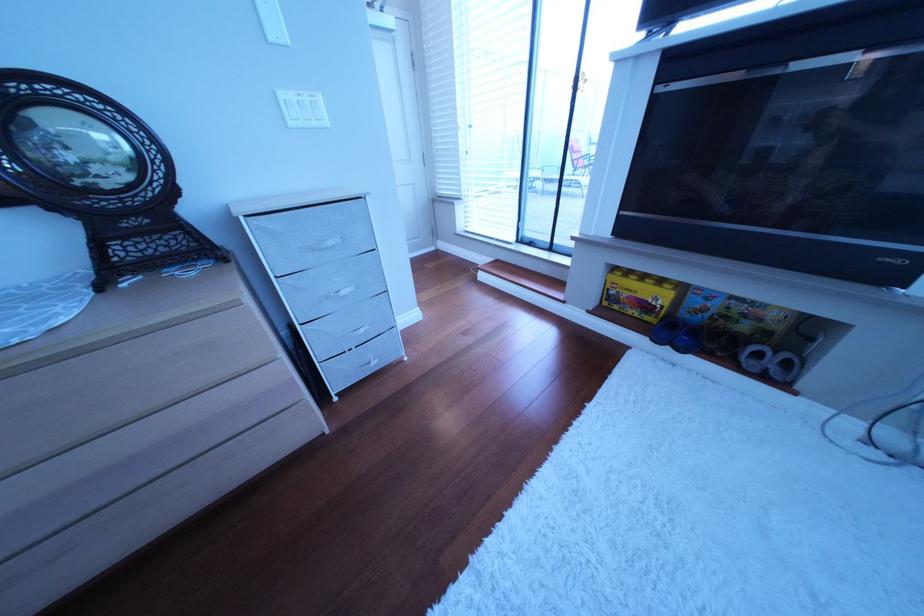
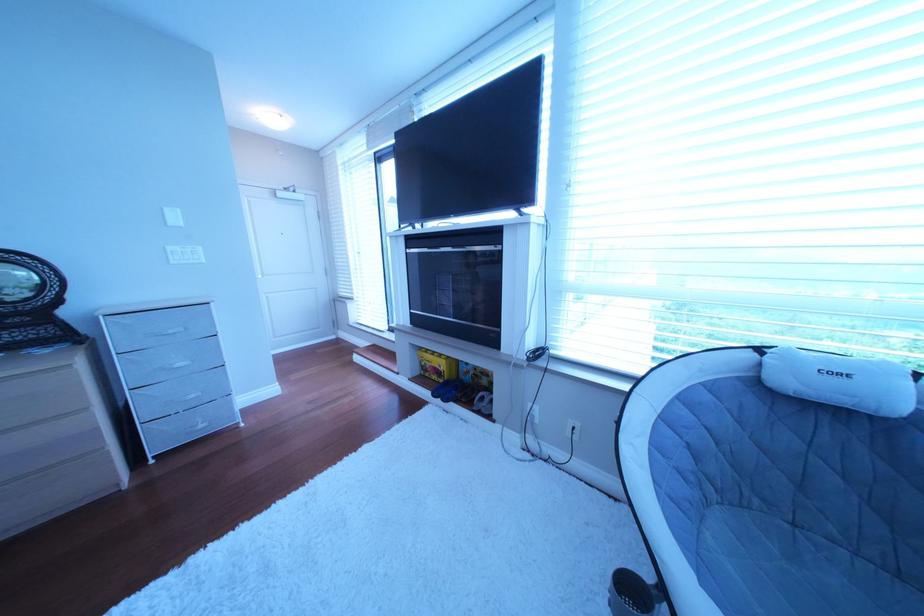
Where in the second image is the point corresponding to point 640,296 from the first image?

(444, 367)